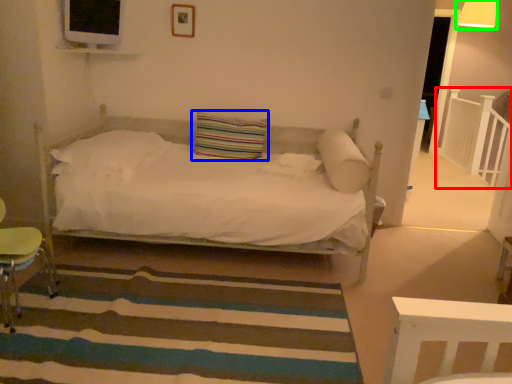
Question: Which is nearer to the balustrade (highlighted by a red box)? pillow (highlighted by a blue box) or lamp (highlighted by a green box).

Choices:
 (A) pillow
 (B) lamp

Answer: (B)